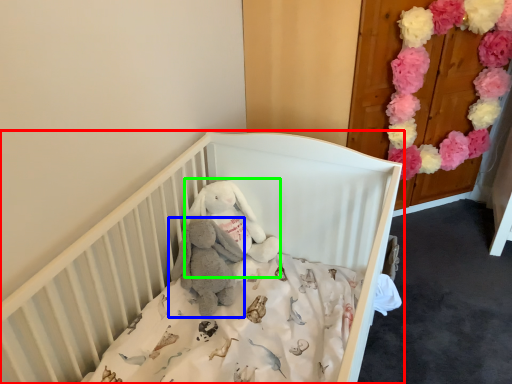
Question: Based on their relative distances, which object is nearer to infant bed (highlighted by a red box)? Choose from baby elephant (highlighted by a blue box) and toy (highlighted by a green box).

Choices:
 (A) baby elephant
 (B) toy

Answer: (B)